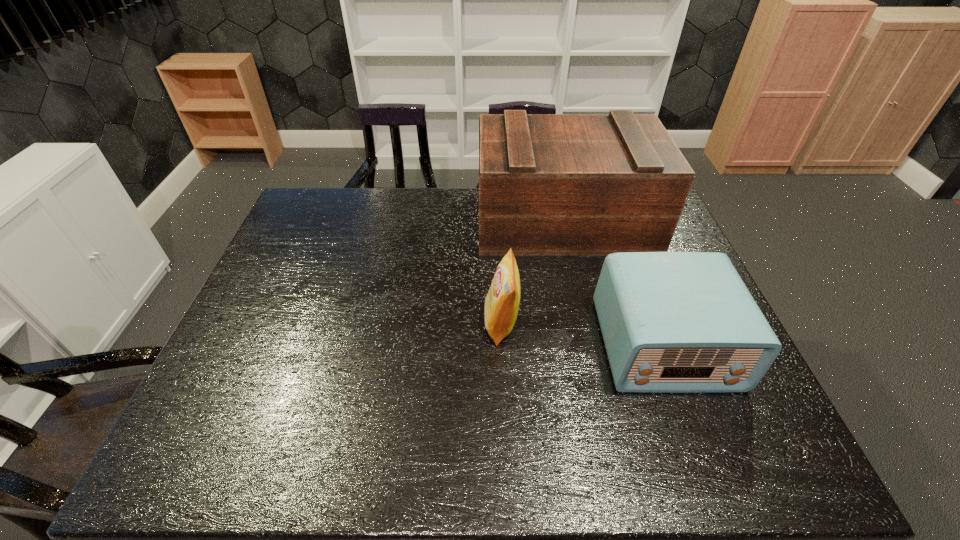
The width and height of the screenshot is (960, 540). Find the location of `the tallest object`. the tallest object is located at coordinates (549, 184).

Identify the location of the farthest object. (549, 184).

Where is `crisp (potato chip)`? This screenshot has height=540, width=960. crisp (potato chip) is located at coordinates (501, 307).

At what (x,y) coordinates should I click in order to perform the action: click on radio receiver. Please return your answer as a coordinate pair (x, y). The width and height of the screenshot is (960, 540). Looking at the image, I should click on (672, 322).

Find the location of a particular element. Image resolution: width=960 pixels, height=540 pixels. free space located on the front of the farthest object is located at coordinates click(577, 273).

The width and height of the screenshot is (960, 540). Find the location of `vacant point located on the front-facing side of the crisp (potato chip)`. vacant point located on the front-facing side of the crisp (potato chip) is located at coordinates (400, 323).

Locate an element on the screen. Image resolution: width=960 pixels, height=540 pixels. vacant point located on the front-facing side of the crisp (potato chip) is located at coordinates (420, 323).

What are the coordinates of `free space located 0.240m on the front-facing side of the crisp (potato chip)` in the screenshot? It's located at (394, 323).

Where is `vacant space located on the front panel of the radio receiver`? This screenshot has width=960, height=540. vacant space located on the front panel of the radio receiver is located at coordinates (708, 459).

The width and height of the screenshot is (960, 540). I want to click on object present at the far edge, so click(x=549, y=184).